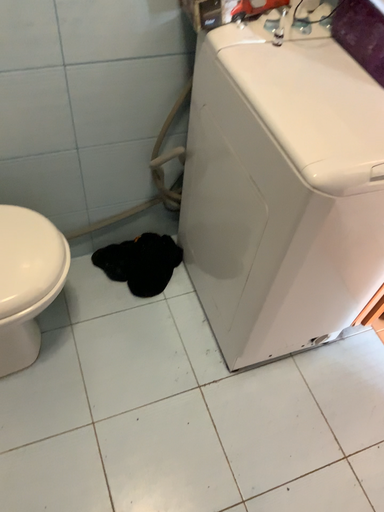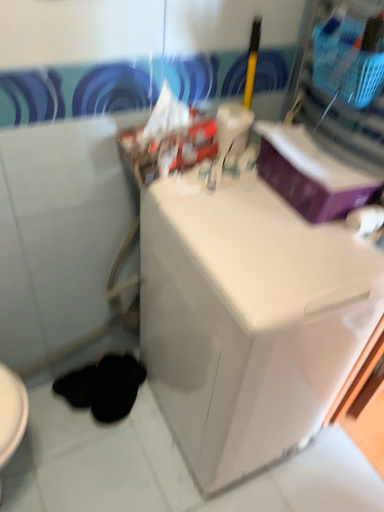
Question: How did the camera likely rotate when shooting the video?

Choices:
 (A) rotated downward
 (B) rotated upward

Answer: (B)